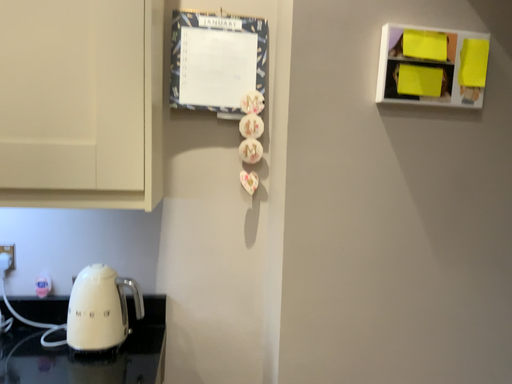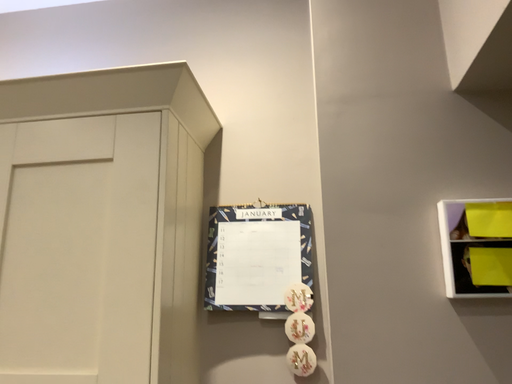
Question: Which way did the camera rotate in the video?

Choices:
 (A) rotated downward
 (B) rotated upward

Answer: (B)